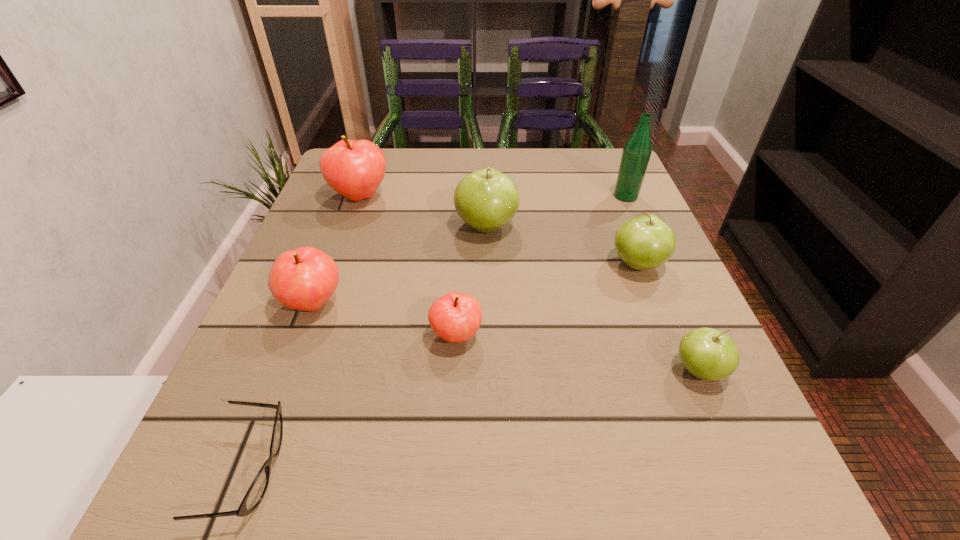
You are a GUI agent. You are given a task and a screenshot of the screen. Output one action in this format:
    pyautogui.click(x=<x>, y=<y>)
    Task: Click on the spectacles
    This screenshot has height=540, width=960.
    Given the screenshot: What is the action you would take?
    pyautogui.click(x=253, y=497)

This screenshot has width=960, height=540. I want to click on free region located on the back of the green bottle, so click(605, 148).

Find the location of a particular element. Image resolution: width=960 pixels, height=540 pixels. vacant region located on the front of the biggest green apple is located at coordinates (488, 343).

The width and height of the screenshot is (960, 540). Find the location of `free space located on the front of the farthest red apple`. free space located on the front of the farthest red apple is located at coordinates (311, 333).

Locate an element on the screen. The width and height of the screenshot is (960, 540). vacant space located on the front of the second smallest red apple is located at coordinates (276, 402).

The height and width of the screenshot is (540, 960). I want to click on free point located 0.360m on the back of the second farthest green apple, so click(x=596, y=160).

This screenshot has width=960, height=540. What are the coordinates of `free location located 0.270m on the back of the rightmost red apple` in the screenshot? It's located at (462, 223).

Where is `vacant space situated 0.350m on the back of the smallest green apple`? This screenshot has height=540, width=960. vacant space situated 0.350m on the back of the smallest green apple is located at coordinates (635, 220).

What are the coordinates of `vacant space situated 0.150m on the front-facing side of the spectacles` in the screenshot? It's located at (397, 470).

The height and width of the screenshot is (540, 960). Find the location of `bottle located in the far edge section of the desktop`. bottle located in the far edge section of the desktop is located at coordinates (637, 151).